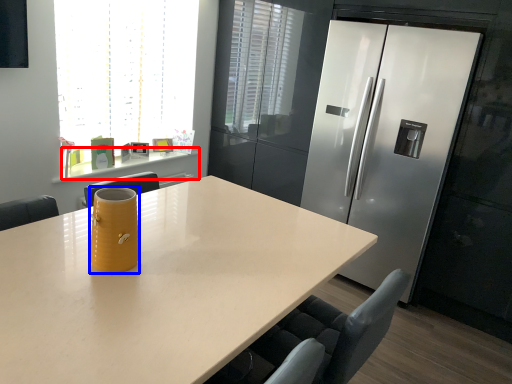
Question: Which point is closer to the camera, counter (highlighted by a red box) or jug (highlighted by a blue box)?

Choices:
 (A) counter
 (B) jug

Answer: (B)